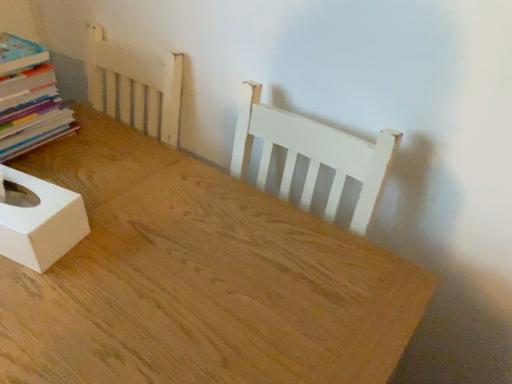
Identify the location of vacant space to the right of multicolored paper stack at left. The height and width of the screenshot is (384, 512). (94, 142).